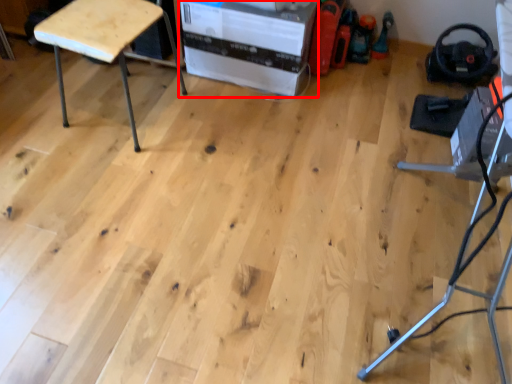
Question: From the image's perspective, what is the correct spatial relationship of cardboard box (annotated by the red box) in relation to furniture?

Choices:
 (A) below
 (B) above

Answer: (B)